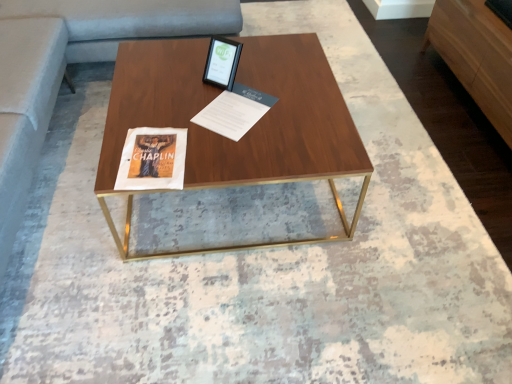
Identify the location of blank area to the left of matte black tablet at upper center. (177, 78).